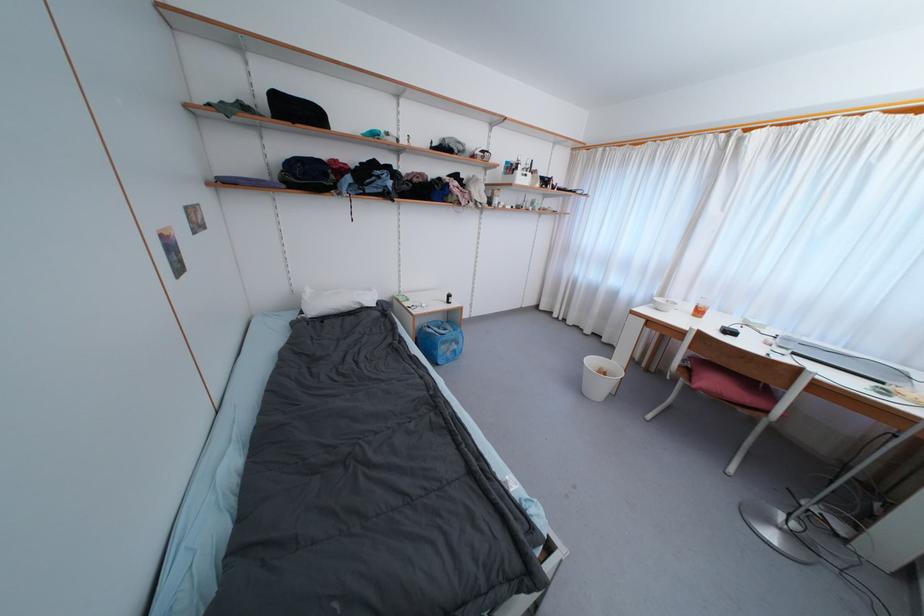
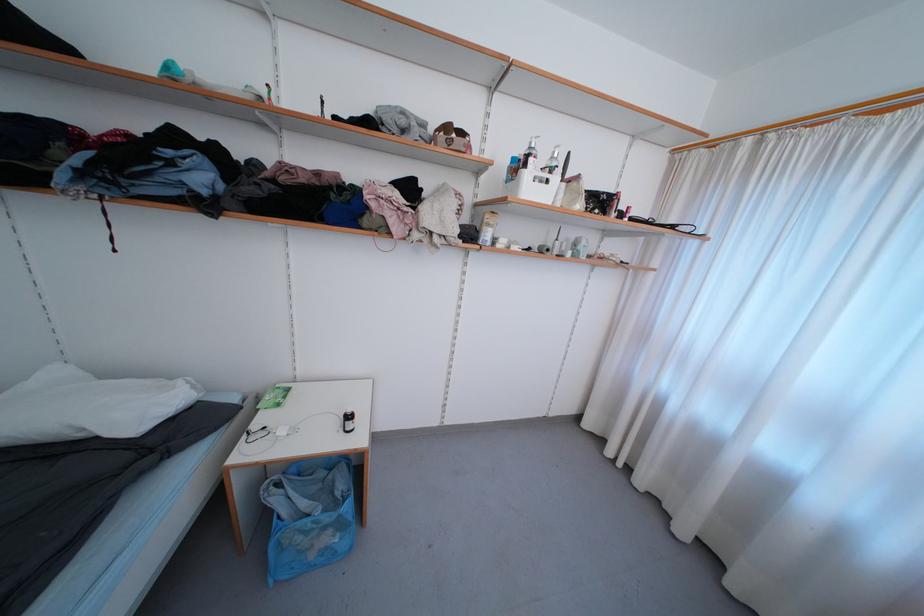
Locate, in the second image, the point that corresponds to [456,302] in the first image.

(354, 429)